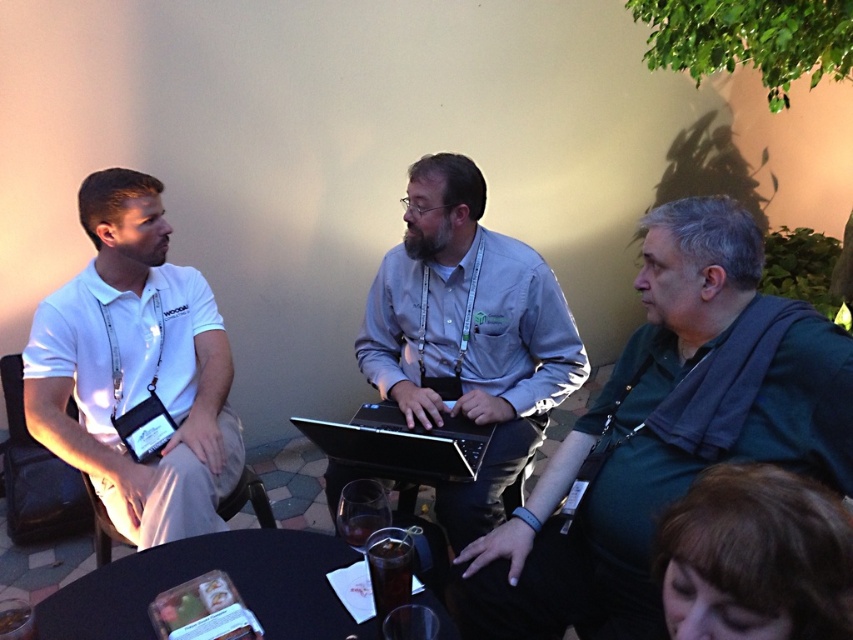
Question: Does dark green shirt at center appear on the left side of black matte laptop at center?

Choices:
 (A) no
 (B) yes

Answer: (A)

Question: Is the position of gray matte shirt at center more distant than that of black plastic table at lower center?

Choices:
 (A) no
 (B) yes

Answer: (B)

Question: Which object appears closest to the camera in this image?

Choices:
 (A) gray matte shirt at center
 (B) dark green shirt at center
 (C) black matte laptop at center
 (D) white matte polo shirt at left

Answer: (B)

Question: Which point is closer to the camera taking this photo?

Choices:
 (A) (142, 179)
 (B) (444, 368)
 (C) (358, 442)

Answer: (C)

Question: Does white matte polo shirt at left appear on the right side of gray matte shirt at center?

Choices:
 (A) yes
 (B) no

Answer: (B)

Question: Which of these objects is positioned farthest from the black matte laptop at center?

Choices:
 (A) black plastic table at lower center
 (B) gray matte shirt at center
 (C) white matte polo shirt at left

Answer: (C)